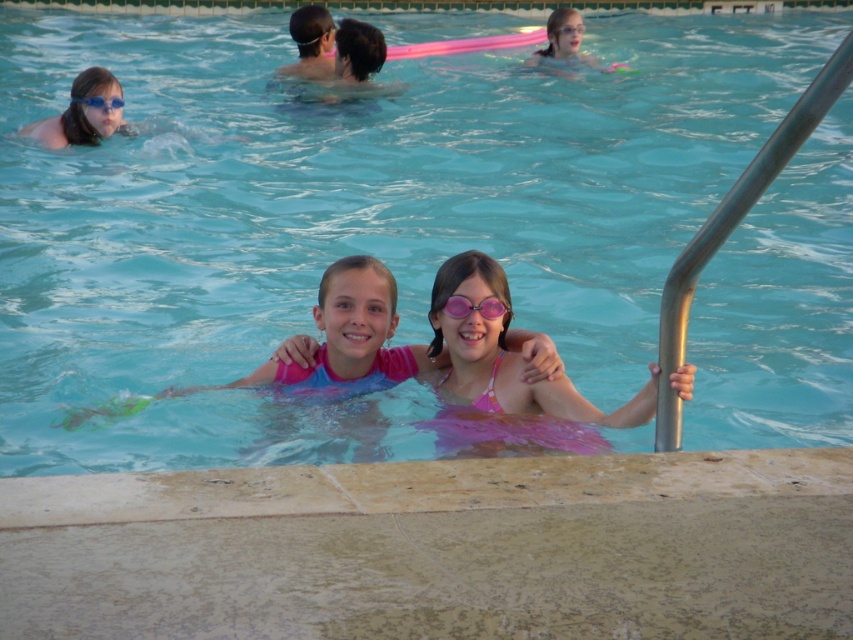
Question: Among these points, which one is nearest to the camera?

Choices:
 (A) (376, 339)
 (B) (467, 305)

Answer: (B)

Question: Can you confirm if smooth concrete edge at lower center is positioned below matte blue goggles at upper left?

Choices:
 (A) no
 (B) yes

Answer: (A)

Question: Which of the following is the farthest from the observer?

Choices:
 (A) matte pink goggles at upper left
 (B) matte blue goggles at upper left
 (C) smooth concrete edge at lower center

Answer: (A)

Question: Considering the relative positions of matte blue goggles at upper left and matte pink goggles at upper left in the image provided, where is matte blue goggles at upper left located with respect to matte pink goggles at upper left?

Choices:
 (A) left
 (B) right

Answer: (A)

Question: Which point is closer to the camera taking this photo?

Choices:
 (A) (109, 97)
 (B) (572, 138)

Answer: (A)

Question: Can you confirm if pink matte goggles at center is positioned to the left of matte pink goggles at upper left?

Choices:
 (A) no
 (B) yes

Answer: (A)